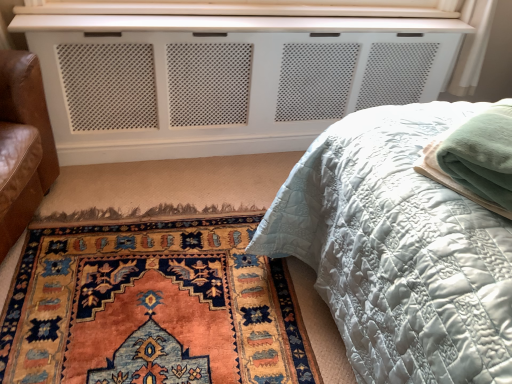
Question: From a real-world perspective, is green fleece blanket at right positioned over white perforated panel at upper center based on gravity?

Choices:
 (A) no
 (B) yes

Answer: (B)

Question: Is green fleece blanket at right wider than white perforated panel at upper center?

Choices:
 (A) no
 (B) yes

Answer: (B)

Question: Is the position of green fleece blanket at right less distant than that of white perforated panel at upper center?

Choices:
 (A) no
 (B) yes

Answer: (B)

Question: Could white perforated panel at upper center be considered to be inside green fleece blanket at right?

Choices:
 (A) yes
 (B) no

Answer: (B)

Question: From the image's perspective, is green fleece blanket at right located beneath white perforated panel at upper center?

Choices:
 (A) no
 (B) yes

Answer: (B)

Question: In the image, is matte white quilted bed at center positioned in front of or behind carpet with intricate patterns at lower left?

Choices:
 (A) front
 (B) behind

Answer: (A)

Question: From a real-world perspective, relative to carpet with intricate patterns at lower left, is matte white quilted bed at center vertically above or below?

Choices:
 (A) below
 (B) above

Answer: (B)

Question: Considering the relative positions of matte white quilted bed at center and carpet with intricate patterns at lower left in the image provided, is matte white quilted bed at center to the left or to the right of carpet with intricate patterns at lower left?

Choices:
 (A) left
 (B) right

Answer: (B)

Question: Based on their sizes in the image, would you say matte white quilted bed at center is bigger or smaller than carpet with intricate patterns at lower left?

Choices:
 (A) small
 (B) big

Answer: (B)

Question: In the image, is matte white quilted bed at center positioned in front of or behind green fleece blanket at right?

Choices:
 (A) behind
 (B) front

Answer: (B)

Question: Considering the relative positions of matte white quilted bed at center and green fleece blanket at right in the image provided, is matte white quilted bed at center to the left or to the right of green fleece blanket at right?

Choices:
 (A) left
 (B) right

Answer: (A)

Question: Looking at their shapes, would you say matte white quilted bed at center is wider or thinner than green fleece blanket at right?

Choices:
 (A) thin
 (B) wide

Answer: (B)

Question: Is matte white quilted bed at center taller or shorter than green fleece blanket at right?

Choices:
 (A) short
 (B) tall

Answer: (B)

Question: Which is correct: matte white quilted bed at center is inside white perforated panel at upper center, or outside of it?

Choices:
 (A) inside
 (B) outside

Answer: (B)

Question: From their relative heights in the image, would you say matte white quilted bed at center is taller or shorter than white perforated panel at upper center?

Choices:
 (A) tall
 (B) short

Answer: (A)